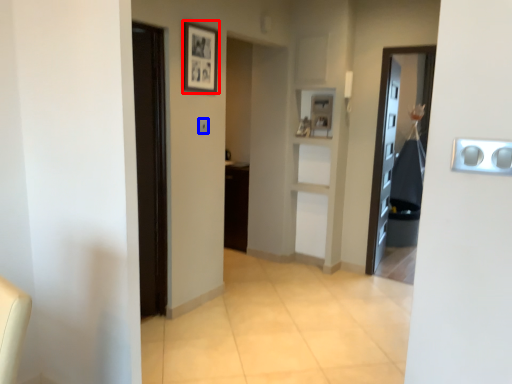
Question: Which point is further to the camera, picture frame (highlighted by a red box) or light switch (highlighted by a blue box)?

Choices:
 (A) picture frame
 (B) light switch

Answer: (B)